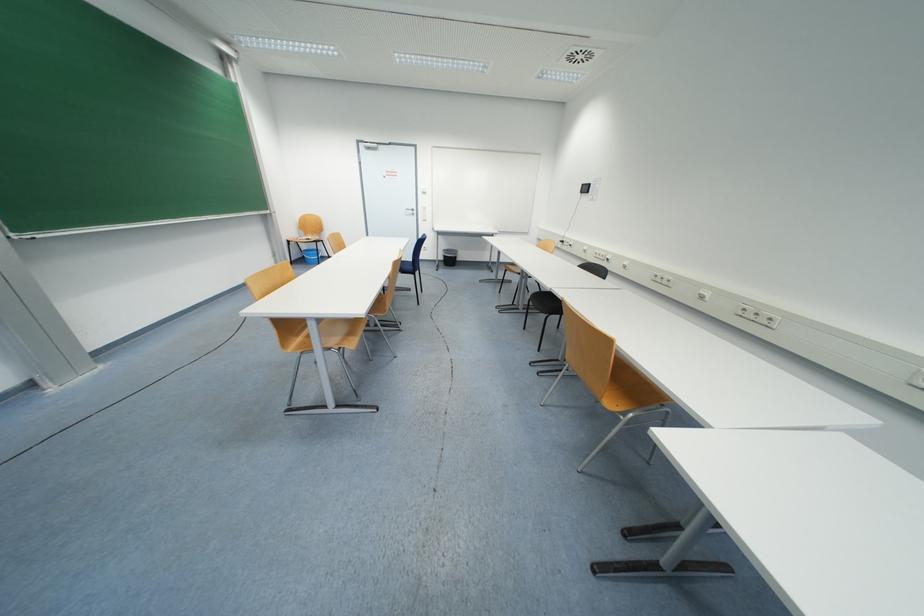
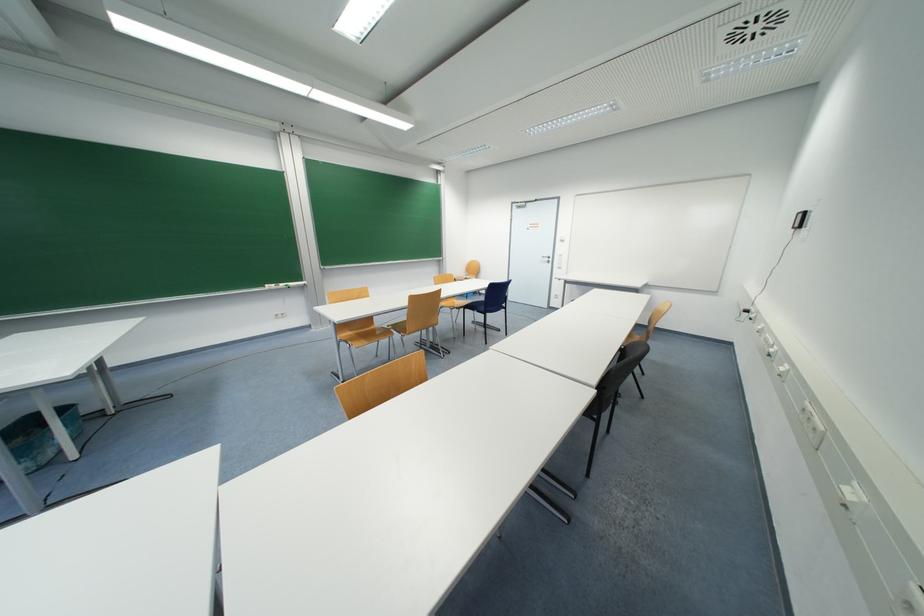
Question: I am providing you with two images of the same scene from different viewpoints. Please identify which objects are invisible in image2.

Choices:
 (A) white board eraser
 (B) black chair sitting surface
 (C) blue trash bin
 (D) blue ink pen

Answer: (B)